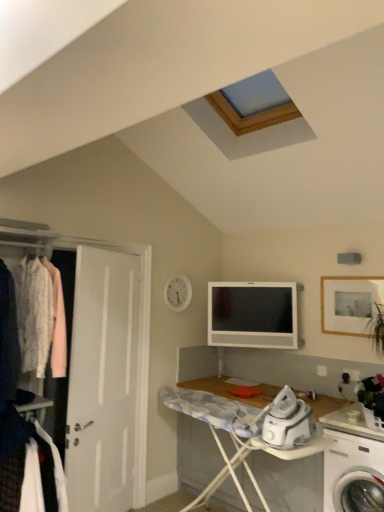
Question: Considering the relative sizes of white plastic washing machine at lower right and satin silver television at center in the image provided, is white plastic washing machine at lower right wider than satin silver television at center?

Choices:
 (A) no
 (B) yes

Answer: (B)

Question: From a real-world perspective, is white plastic washing machine at lower right physically above satin silver television at center?

Choices:
 (A) yes
 (B) no

Answer: (B)

Question: Is white plastic washing machine at lower right not inside satin silver television at center?

Choices:
 (A) yes
 (B) no

Answer: (A)

Question: Is white plastic washing machine at lower right further to the viewer compared to satin silver television at center?

Choices:
 (A) yes
 (B) no

Answer: (B)

Question: Does white plastic washing machine at lower right have a larger size compared to satin silver television at center?

Choices:
 (A) yes
 (B) no

Answer: (A)

Question: From the image's perspective, relative to white fabric at left, is satin silver television at center above or below?

Choices:
 (A) above
 (B) below

Answer: (A)

Question: In terms of height, does satin silver television at center look taller or shorter compared to white fabric at left?

Choices:
 (A) tall
 (B) short

Answer: (B)

Question: Choose the correct answer: Is satin silver television at center inside white fabric at left or outside it?

Choices:
 (A) outside
 (B) inside

Answer: (A)

Question: Considering the positions of point (291, 316) and point (54, 458), is point (291, 316) closer or farther from the camera than point (54, 458)?

Choices:
 (A) farther
 (B) closer

Answer: (A)

Question: Would you say wooden framed photo at upper right is to the left or to the right of wooden ironing board at lower center in the picture?

Choices:
 (A) left
 (B) right

Answer: (B)

Question: In the image, is wooden framed photo at upper right positioned in front of or behind wooden ironing board at lower center?

Choices:
 (A) front
 (B) behind

Answer: (B)

Question: From the image's perspective, is wooden framed photo at upper right above or below wooden ironing board at lower center?

Choices:
 (A) below
 (B) above

Answer: (B)

Question: Looking at their shapes, would you say wooden framed photo at upper right is wider or thinner than wooden ironing board at lower center?

Choices:
 (A) thin
 (B) wide

Answer: (A)

Question: From a real-world perspective, is white plastic washing machine at lower right above or below satin silver television at center?

Choices:
 (A) above
 (B) below

Answer: (B)

Question: In terms of height, does white plastic washing machine at lower right look taller or shorter compared to satin silver television at center?

Choices:
 (A) tall
 (B) short

Answer: (A)